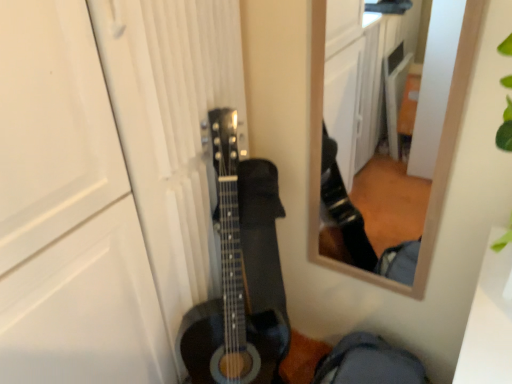
Question: Should I look upward or downward to see black matte acoustic guitar at center?

Choices:
 (A) down
 (B) up

Answer: (A)